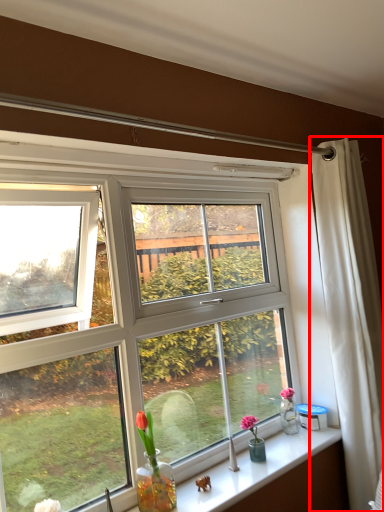
Question: From the image's perspective, where is curtain (annotated by the red box) located in relation to window sill in the image?

Choices:
 (A) above
 (B) below

Answer: (A)